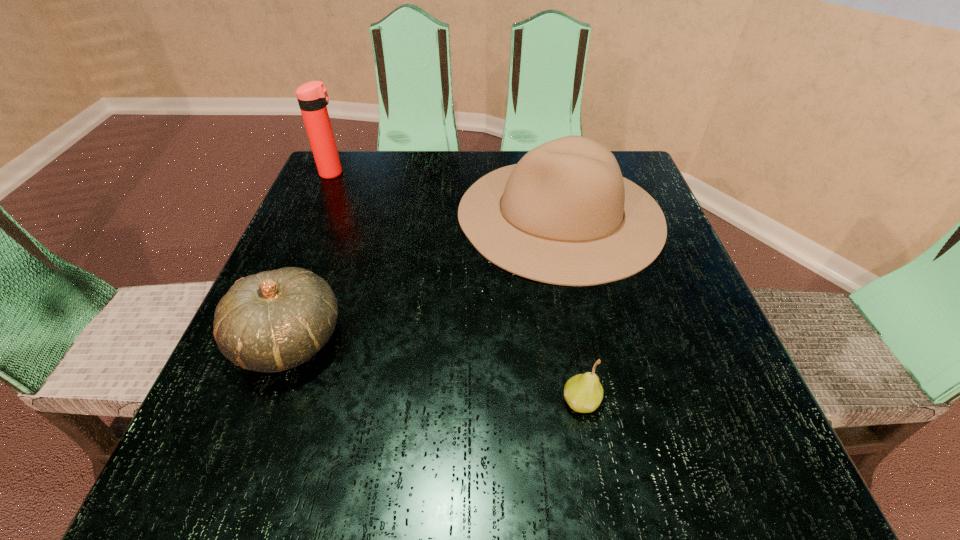
I want to click on thermos bottle that is at the left edge, so click(312, 96).

Find the location of `gourd that is positioned at the left edge`. gourd that is positioned at the left edge is located at coordinates (272, 321).

The width and height of the screenshot is (960, 540). Find the location of `object located in the right edge section of the desktop`. object located in the right edge section of the desktop is located at coordinates (569, 217).

This screenshot has height=540, width=960. I want to click on object that is at the far left corner, so coord(312,96).

I want to click on object present at the far right corner, so click(569, 217).

Find the location of a particular element. vacant space at the far edge is located at coordinates (421, 193).

The height and width of the screenshot is (540, 960). I want to click on vacant space at the near edge of the desktop, so click(x=573, y=447).

Find the location of a particular element. The image size is (960, 540). vacant space at the left edge of the desktop is located at coordinates (341, 231).

Identify the location of free region at the right edge. coord(687,386).

In the image, there is a desktop. At what (x,y) coordinates should I click in order to perform the action: click on free region at the far left corner. Please return your answer as a coordinate pair (x, y). This screenshot has height=540, width=960. Looking at the image, I should click on (387, 152).